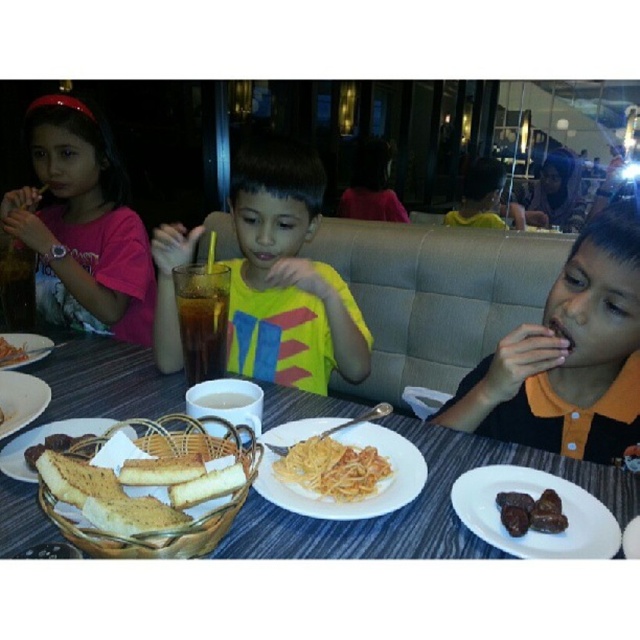
Is matte yellow shirt at center wider than white matte bread basket at lower left?

Yes, matte yellow shirt at center is wider than white matte bread basket at lower left.

Locate an element on the screen. The width and height of the screenshot is (640, 640). matte yellow shirt at center is located at coordinates (285, 276).

The width and height of the screenshot is (640, 640). Identify the location of matte yellow shirt at center. (285, 276).

Is point (273, 461) closer to camera compared to point (8, 344)?

Yes, it is.

What are the coordinates of `yellow matte pasta at center` in the screenshot? It's located at (332, 467).

Does point (328, 444) come in front of point (3, 340)?

Yes, point (328, 444) is in front of point (3, 340).

Locate an element on the screen. yellow matte pasta at center is located at coordinates (332, 467).

Which of these two, breadcrustybasket at lower left or white matte bread basket at lower left, stands taller?

Standing taller between the two is breadcrustybasket at lower left.

Does point (104, 556) come closer to viewer compared to point (0, 435)?

Yes, it is.

Identify the location of breadcrustybasket at lower left. This screenshot has height=640, width=640. (186, 508).